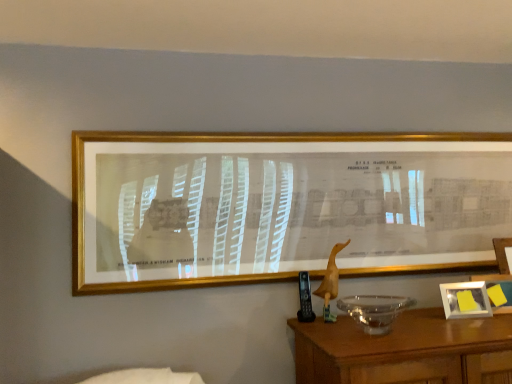
Question: Is transparent glass bowl at lower right inside the boundaries of white plastic picture frame at lower right, positioned as the 2th picture frame in left-to-right order, or outside?

Choices:
 (A) inside
 (B) outside

Answer: (B)

Question: In terms of width, does transparent glass bowl at lower right look wider or thinner when compared to white plastic picture frame at lower right, positioned as the 2th picture frame in left-to-right order?

Choices:
 (A) wide
 (B) thin

Answer: (A)

Question: Estimate the real-world distances between objects in this image. Which object is closer to the white plastic picture frame at lower right, positioned as the first picture frame in right-to-left order?

Choices:
 (A) transparent glass bowl at lower right
 (B) gold metallic picture frame at upper center, the 2th picture frame from the right

Answer: (A)

Question: Estimate the real-world distances between objects in this image. Which object is closer to the white plastic picture frame at lower right, acting as the 1th picture frame starting from the back?

Choices:
 (A) transparent glass bowl at lower right
 (B) gold metallic picture frame at upper center, the first picture frame positioned from the top

Answer: (A)